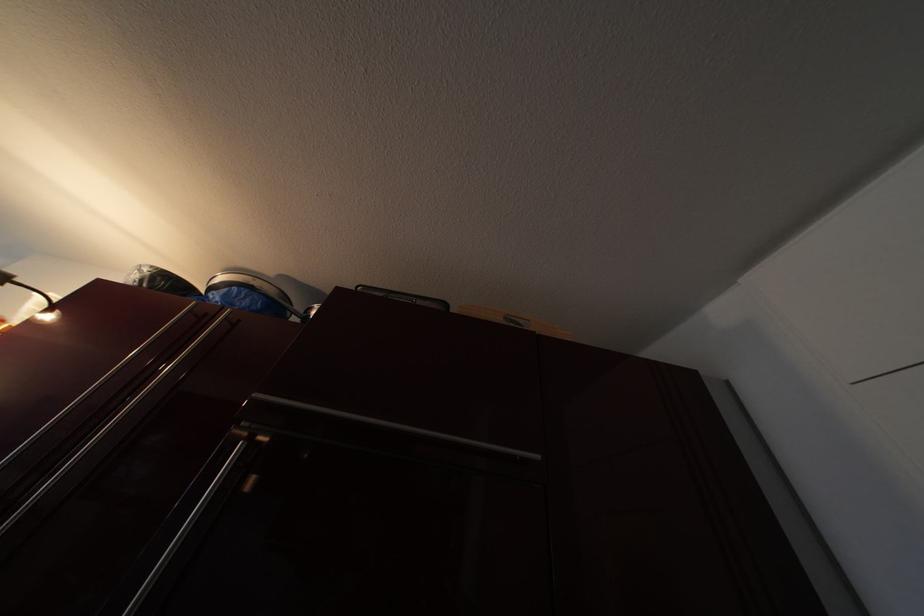
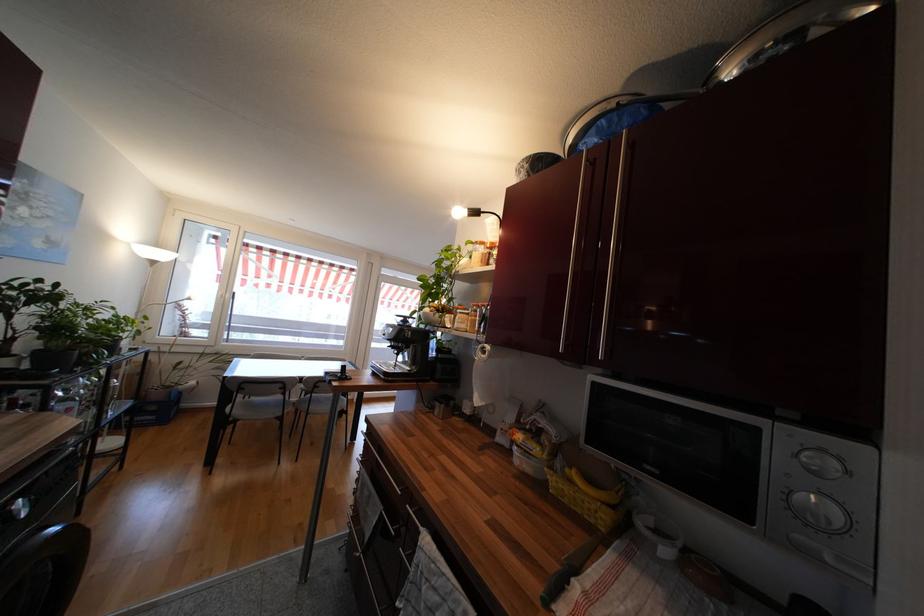
Question: The camera is either moving clockwise (left) or counter-clockwise (right) around the object. The first image is from the beginning of the video and the second image is from the end. Is the camera moving left or right when shooting the video?

Choices:
 (A) Left
 (B) Right

Answer: (B)